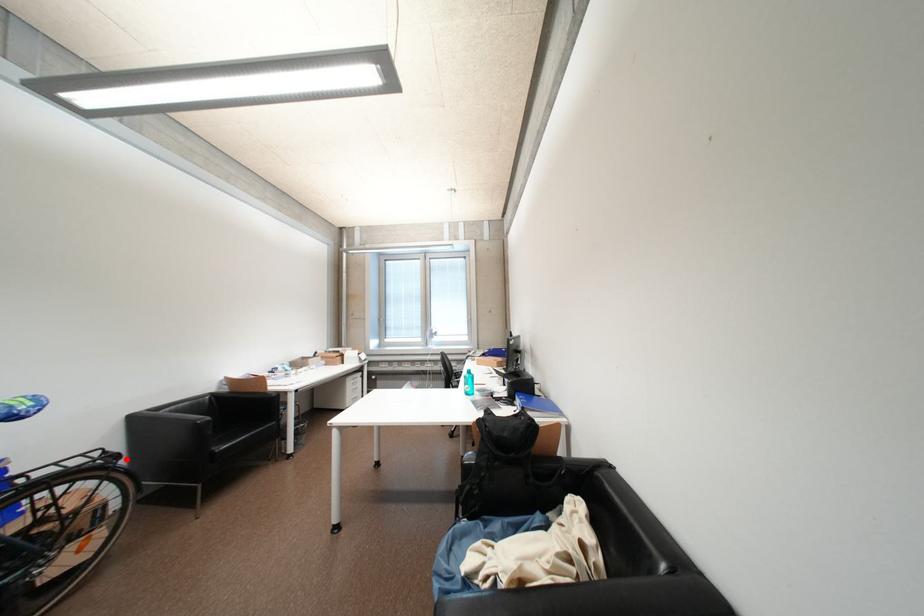
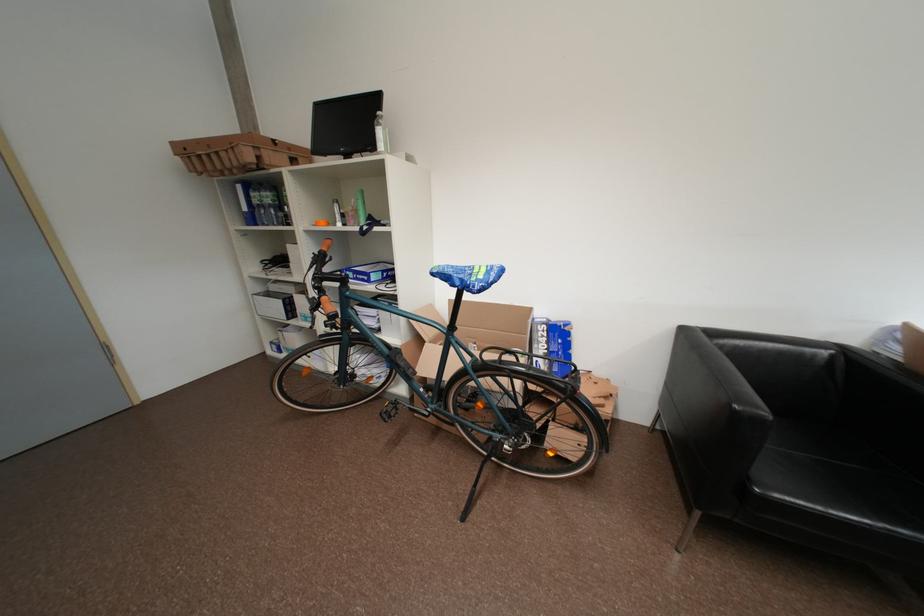
Locate, in the second image, the point that corresponds to the highlighted location in the first image.

(582, 391)